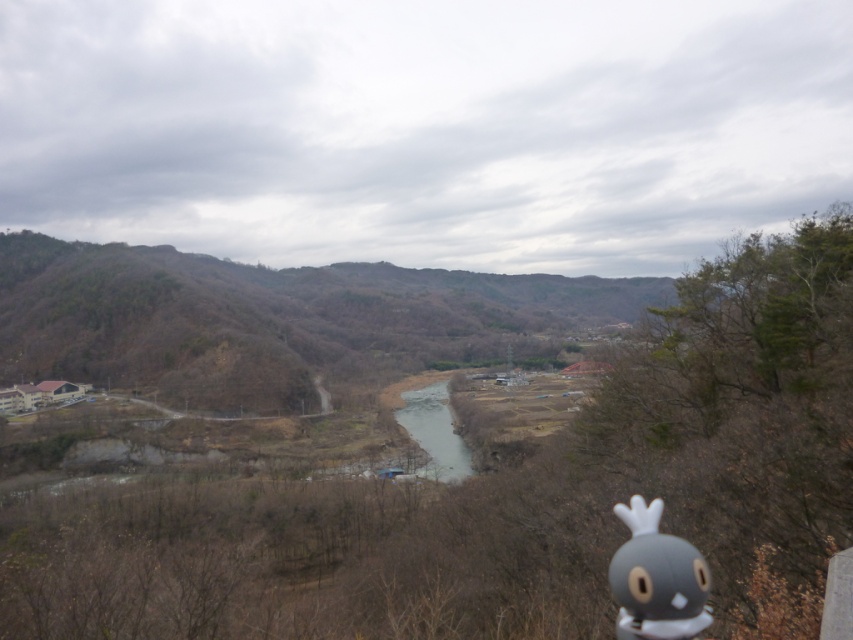
This screenshot has width=853, height=640. What do you see at coordinates (276, 321) in the screenshot?
I see `green leafy hillside at left` at bounding box center [276, 321].

Who is shorter, green leafy hillside at left or clear water at center?

With less height is clear water at center.

Which is behind, point (134, 355) or point (415, 426)?

The point (134, 355) is behind.

Locate an element on the screen. This screenshot has height=640, width=853. green leafy hillside at left is located at coordinates (276, 321).

Consider the image. Is gray matte toy at lower right smaller than clear water at center?

Indeed, gray matte toy at lower right has a smaller size compared to clear water at center.

Is point (683, 580) closer to viewer compared to point (428, 436)?

Yes, point (683, 580) is in front of point (428, 436).

Who is more forward, (x=675, y=538) or (x=457, y=449)?

Point (x=675, y=538) is in front.

This screenshot has width=853, height=640. What are the coordinates of `gray matte toy at lower right` in the screenshot? It's located at (656, 579).

Who is positioned more to the right, green leafy hillside at left or gray matte toy at lower right?

From the viewer's perspective, gray matte toy at lower right appears more on the right side.

Looking at this image, does green leafy hillside at left appear on the right side of gray matte toy at lower right?

Incorrect, green leafy hillside at left is not on the right side of gray matte toy at lower right.

Measure the distance between point [614,285] and camera.

Point [614,285] is 1941.65 feet from camera.

This screenshot has width=853, height=640. What are the coordinates of `green leafy hillside at left` in the screenshot? It's located at (276, 321).